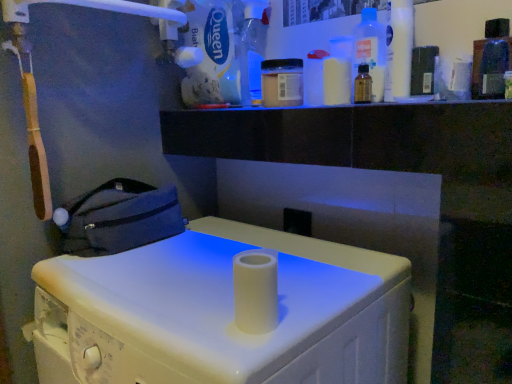
Locate an element on the screen. unoccupied region to the right of dark blue fabric bag at left is located at coordinates (190, 243).